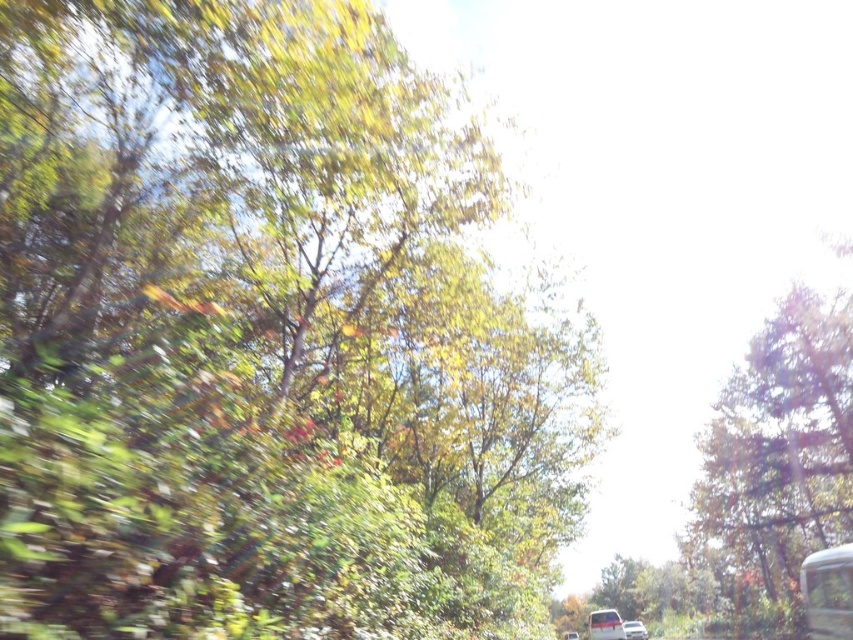
Question: Observing the image, what is the correct spatial positioning of green leafy tree at right in reference to white glossy car at lower center?

Choices:
 (A) below
 (B) above

Answer: (B)

Question: Which object is farther from the camera taking this photo?

Choices:
 (A) white glossy school bus at right
 (B) green leafy tree at upper left
 (C) white glossy car at lower center

Answer: (C)

Question: Does green leafy tree at upper left have a larger size compared to green leafy tree at right?

Choices:
 (A) no
 (B) yes

Answer: (A)

Question: Which object appears farthest from the camera in this image?

Choices:
 (A) white matte car at lower center
 (B) white glossy school bus at right

Answer: (A)

Question: Does white glossy school bus at right come in front of white matte car at lower center?

Choices:
 (A) yes
 (B) no

Answer: (A)

Question: Which point is closer to the camera taking this photo?

Choices:
 (A) (830, 618)
 (B) (502, 387)

Answer: (A)